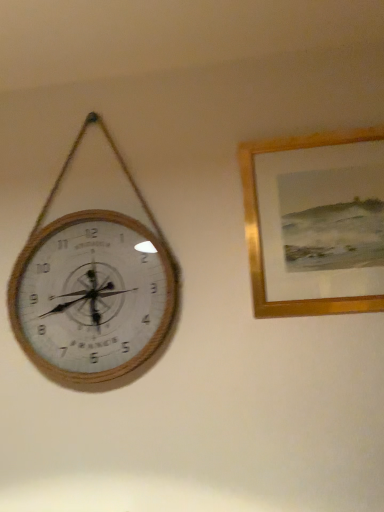
Question: Considering the positions of gold wooden picture frame at upper right and wooden clock at left in the image, is gold wooden picture frame at upper right wider or thinner than wooden clock at left?

Choices:
 (A) thin
 (B) wide

Answer: (A)

Question: Is gold wooden picture frame at upper right in front of or behind wooden clock at left in the image?

Choices:
 (A) front
 (B) behind

Answer: (A)

Question: Is point (369, 308) closer or farther from the camera than point (140, 288)?

Choices:
 (A) farther
 (B) closer

Answer: (B)

Question: Is point (147, 230) closer or farther from the camera than point (372, 138)?

Choices:
 (A) farther
 (B) closer

Answer: (A)

Question: Considering the relative positions of wooden clock at left and gold wooden picture frame at upper right in the image provided, is wooden clock at left to the left or to the right of gold wooden picture frame at upper right?

Choices:
 (A) left
 (B) right

Answer: (A)

Question: From a real-world perspective, is wooden clock at left physically located above or below gold wooden picture frame at upper right?

Choices:
 (A) below
 (B) above

Answer: (B)

Question: From their relative heights in the image, would you say wooden clock at left is taller or shorter than gold wooden picture frame at upper right?

Choices:
 (A) short
 (B) tall

Answer: (B)